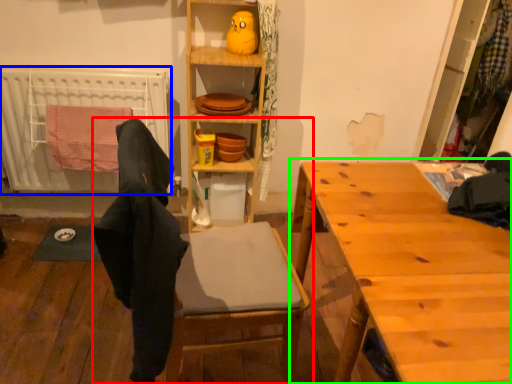
Question: Which object is positioned farthest from chair (highlighted by a red box)? Select from radiator (highlighted by a blue box) and table (highlighted by a green box).

Choices:
 (A) radiator
 (B) table

Answer: (A)